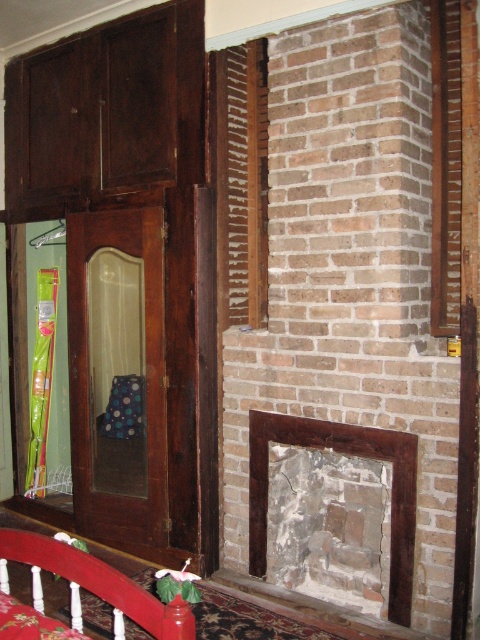
Question: Which of the following is the closest to the observer?

Choices:
 (A) (73, 552)
 (B) (412, 564)
 (C) (223, 131)

Answer: (A)

Question: Among these points, which one is farthest from the camera?

Choices:
 (A) click(x=392, y=497)
 (B) click(x=233, y=115)

Answer: (B)

Question: Can you confirm if wooden slats at center is bigger than red wood bed rail at lower left?

Choices:
 (A) no
 (B) yes

Answer: (A)

Question: Is rustic stone fireplace at center smaller than red wood bed rail at lower left?

Choices:
 (A) yes
 (B) no

Answer: (B)

Question: Among these objects, which one is farthest from the camera?

Choices:
 (A) rustic stone fireplace at center
 (B) wooden slats at center
 (C) red wood bed rail at lower left

Answer: (B)

Question: In this image, where is rustic stone fireplace at center located relative to red wood bed rail at lower left?

Choices:
 (A) left
 (B) right

Answer: (B)